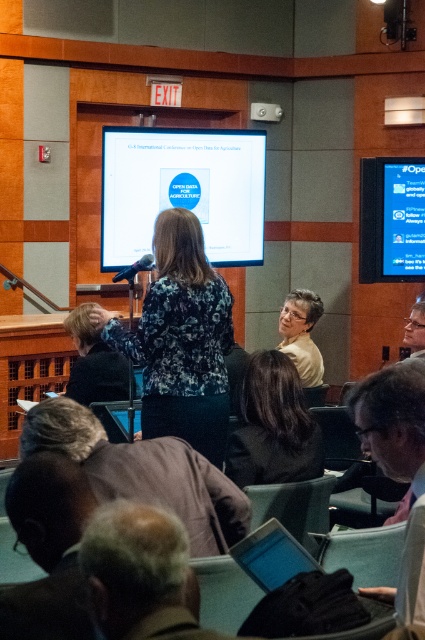
How distant is black hair at center from blue glossy screen at upper center?

black hair at center and blue glossy screen at upper center are 3.39 meters apart from each other.

Which of these two, black hair at center or blue glossy screen at upper center, stands shorter?

black hair at center is shorter.

Is point (229, 452) more distant than point (393, 205)?

That is False.

The height and width of the screenshot is (640, 425). In order to click on black hair at center in this screenshot , I will do (272, 426).

Does floral-patterned blouse at center come in front of blue glossy screen at upper center?

Yes.

Does floral-patterned blouse at center have a lesser height compared to blue glossy screen at upper center?

Incorrect, floral-patterned blouse at center's height does not fall short of blue glossy screen at upper center's.

Between point (206, 401) and point (384, 268), which one is positioned in front?

Positioned in front is point (206, 401).

The width and height of the screenshot is (425, 640). Find the location of `floral-patterned blouse at center`. floral-patterned blouse at center is located at coordinates (181, 339).

Can you confirm if brown fabric jacket at lower left is wider than dark brown leather jacket at lower left?

Yes, brown fabric jacket at lower left is wider than dark brown leather jacket at lower left.

Does brown fabric jacket at lower left appear on the left side of dark brown leather jacket at lower left?

Incorrect, brown fabric jacket at lower left is not on the left side of dark brown leather jacket at lower left.

Who is more distant from viewer, (107, 477) or (133, 387)?

Positioned behind is point (133, 387).

Find the location of a particular element. The image size is (425, 640). brown fabric jacket at lower left is located at coordinates (144, 472).